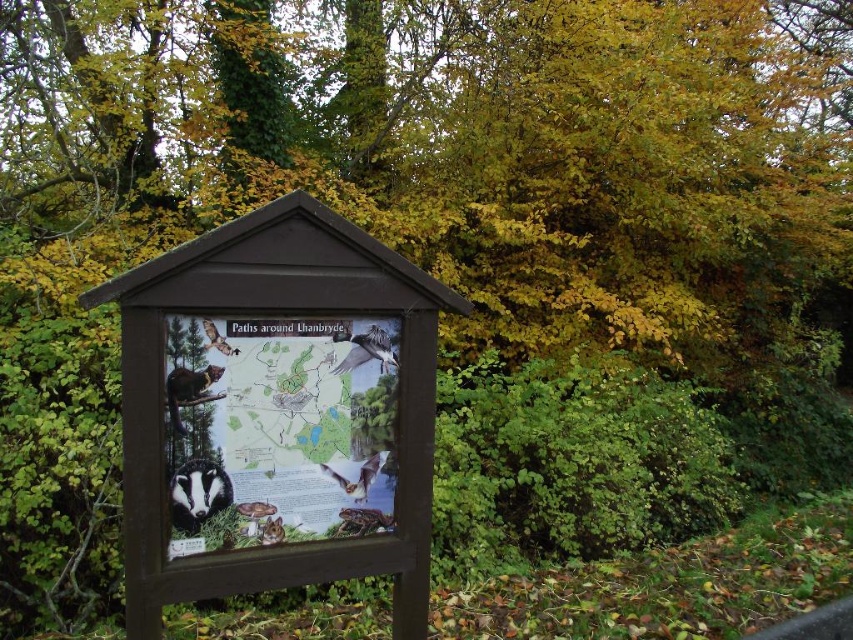
You are standing in front of the wooden information board about Paths around Llanbryde. There is a point marked at coordinates (x=196, y=408) on the board. If you want to touch this point with a stick that is 7 feet long, will the stick be long enough to reach it?

The point at (x=196, y=408) is 7.76 feet away from you. Since the stick is only 7 feet long, it will not be long enough to reach the point.

You are a hiker who wants to check the matte paper map at center and the brown furry bat at center on the information board. Since both are at the center, which one is closer to you?

The brown furry bat at center is closer to you than the matte paper map at center because the matte paper map at center is larger in size than the brown furry bat at center.